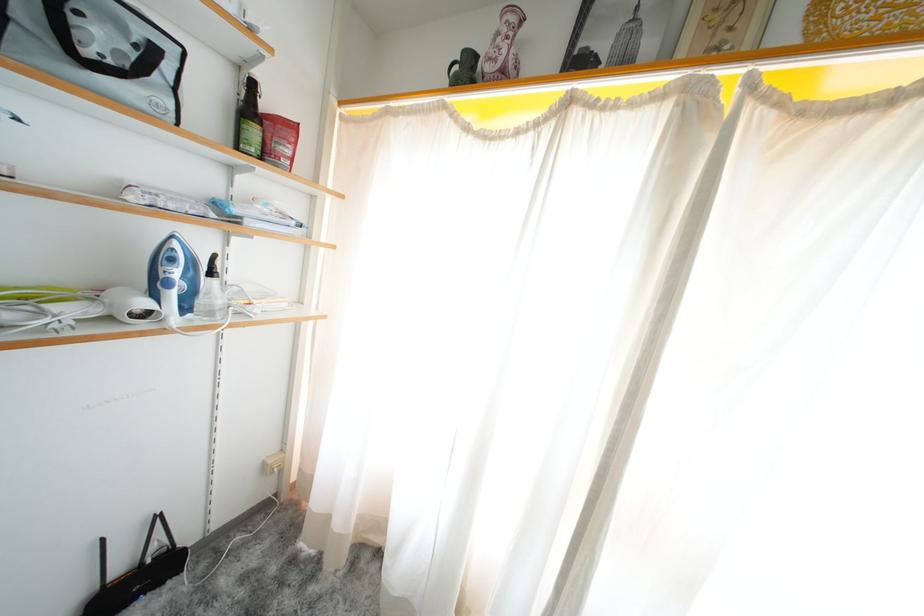
The width and height of the screenshot is (924, 616). In order to click on spray bottle pump in this screenshot , I will do `click(211, 294)`.